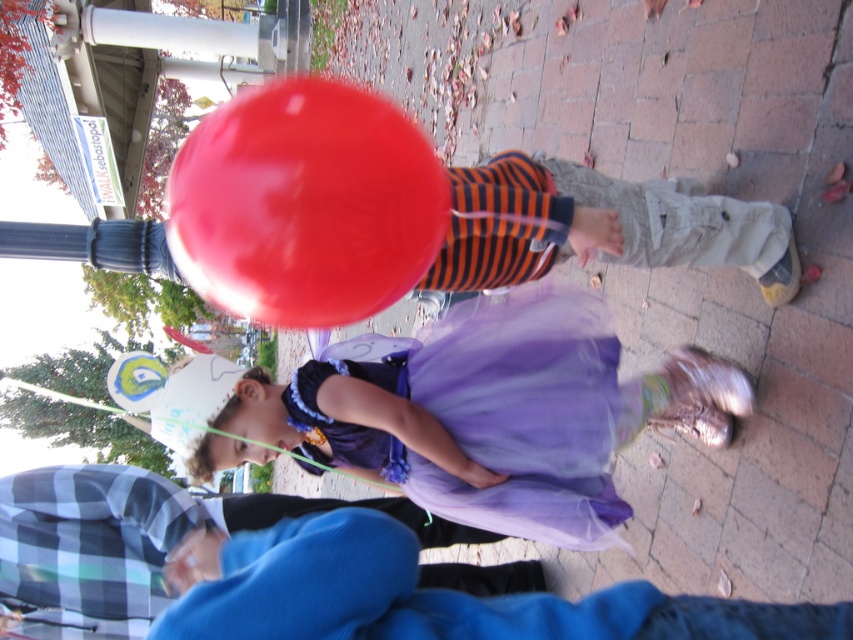
Question: Does purple tulle dress at center come in front of striped fabric pants at center?

Choices:
 (A) no
 (B) yes

Answer: (A)

Question: Where is purple tulle dress at center located in relation to glossy red balloon at center in the image?

Choices:
 (A) above
 (B) below

Answer: (B)

Question: Which point is closer to the camera taking this photo?

Choices:
 (A) (483, 328)
 (B) (756, 221)
 (C) (378, 257)

Answer: (C)

Question: Does purple tulle dress at center come behind glossy red balloon at center?

Choices:
 (A) yes
 (B) no

Answer: (A)

Question: Based on their relative distances, which object is nearer to the purple tulle dress at center?

Choices:
 (A) striped fabric pants at center
 (B) glossy red balloon at center

Answer: (A)

Question: Which point is closer to the camera?

Choices:
 (A) (503, 196)
 (B) (268, 96)
 (C) (495, 500)

Answer: (A)